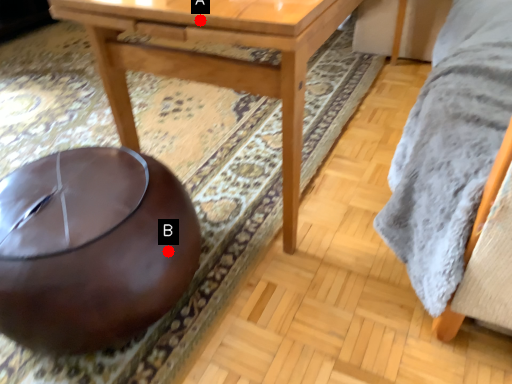
Question: Two points are circled on the image, labeled by A and B beside each circle. Which of the following is the closest to the observer?

Choices:
 (A) A is closer
 (B) B is closer

Answer: (A)